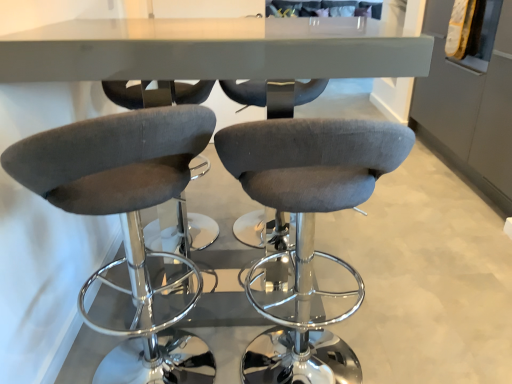
Question: Which is correct: velvet grey stool at center, the second chair viewed from the left, is inside dark gray fabric stool at left, the first chair from the left, or outside of it?

Choices:
 (A) outside
 (B) inside

Answer: (A)

Question: Is velvet grey stool at center, which ranks as the first chair in right-to-left order, in front of or behind dark gray fabric stool at left, the first chair from the left, in the image?

Choices:
 (A) behind
 (B) front

Answer: (A)

Question: Based on their sizes in the image, would you say velvet grey stool at center, the second chair viewed from the left, is bigger or smaller than dark gray fabric stool at left, which appears as the 2th chair when viewed from the right?

Choices:
 (A) big
 (B) small

Answer: (B)

Question: From the image's perspective, is dark gray fabric stool at left, which appears as the 2th chair when viewed from the right, above or below velvet grey stool at center, the second chair viewed from the left?

Choices:
 (A) below
 (B) above

Answer: (A)

Question: Is dark gray fabric stool at left, which appears as the 2th chair when viewed from the right, wider or thinner than velvet grey stool at center, which ranks as the first chair in right-to-left order?

Choices:
 (A) wide
 (B) thin

Answer: (A)

Question: Is dark gray fabric stool at left, which appears as the 2th chair when viewed from the right, inside or outside of velvet grey stool at center, the second chair viewed from the left?

Choices:
 (A) outside
 (B) inside

Answer: (A)

Question: In terms of size, does dark gray fabric stool at left, which appears as the 2th chair when viewed from the right, appear bigger or smaller than velvet grey stool at center, which ranks as the first chair in right-to-left order?

Choices:
 (A) small
 (B) big

Answer: (B)